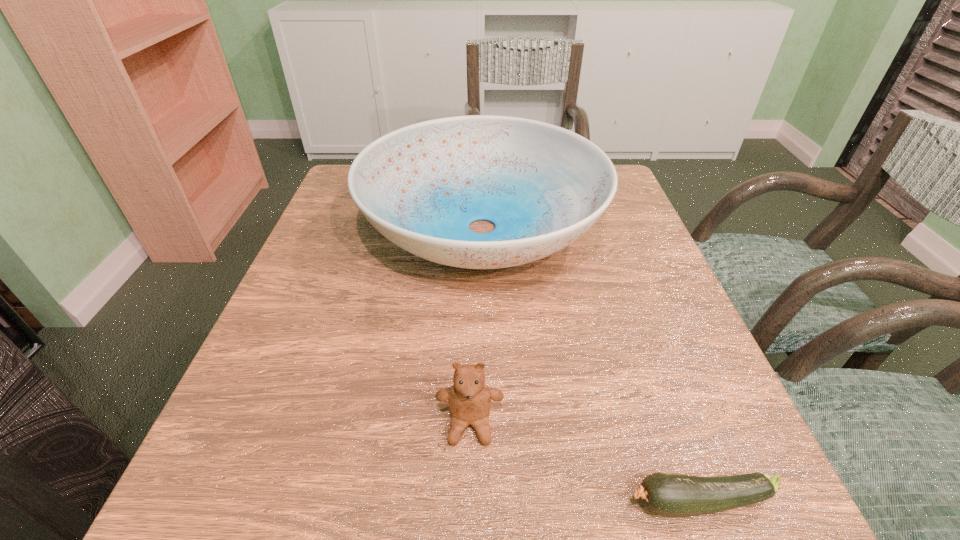
The image size is (960, 540). Find the location of `free space at the left edge of the desktop`. free space at the left edge of the desktop is located at coordinates (363, 301).

The image size is (960, 540). I want to click on free space at the right edge of the desktop, so click(607, 274).

Image resolution: width=960 pixels, height=540 pixels. Find the location of `vacant area at the far left corner`. vacant area at the far left corner is located at coordinates (336, 207).

The width and height of the screenshot is (960, 540). I want to click on vacant space that's between the second tallest object and the shortest object, so click(585, 463).

Find the location of a particular element. This screenshot has height=540, width=960. vacant point located between the second nearest object and the zucchini is located at coordinates (585, 463).

This screenshot has height=540, width=960. What are the coordinates of `free spot between the farthest object and the nearest object` in the screenshot? It's located at (590, 366).

Locate an element on the screen. blank region between the nearest object and the farthest object is located at coordinates (590, 366).

The width and height of the screenshot is (960, 540). Identify the location of empty space between the shortest object and the tallest object. (590, 366).

Locate an element on the screen. The width and height of the screenshot is (960, 540). unoccupied area between the teddy bear and the zucchini is located at coordinates (585, 463).

I want to click on free space between the tallest object and the zucchini, so click(x=590, y=366).